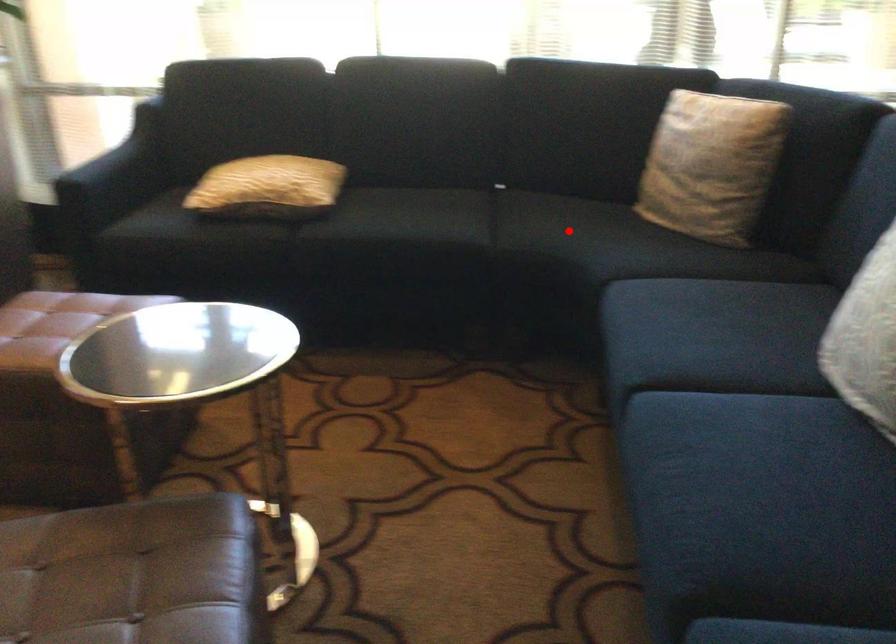
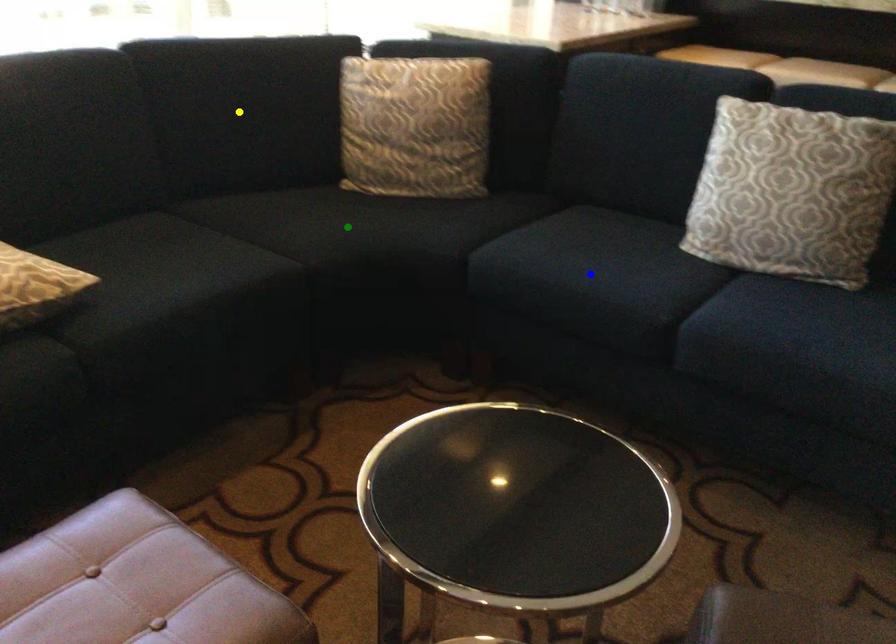
Question: I am providing you with two images of the same scene from different viewpoints. A red point is marked on the first image. You are given multiple points on the second image. Which mark in image 2 goes with the point in image 1?

Choices:
 (A) green point
 (B) yellow point
 (C) blue point

Answer: (A)